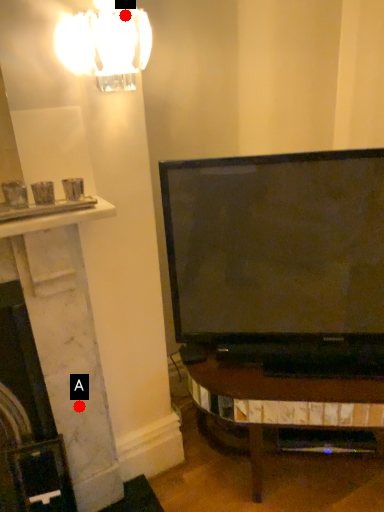
Question: Two points are circled on the image, labeled by A and B beside each circle. Which point is closer to the camera?

Choices:
 (A) A is closer
 (B) B is closer

Answer: (B)